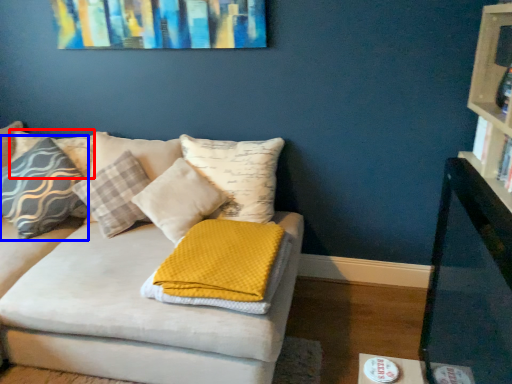
Question: Which of the following is the farthest to the observer, pillow (highlighted by a red box) or pillow (highlighted by a blue box)?

Choices:
 (A) pillow
 (B) pillow

Answer: (A)